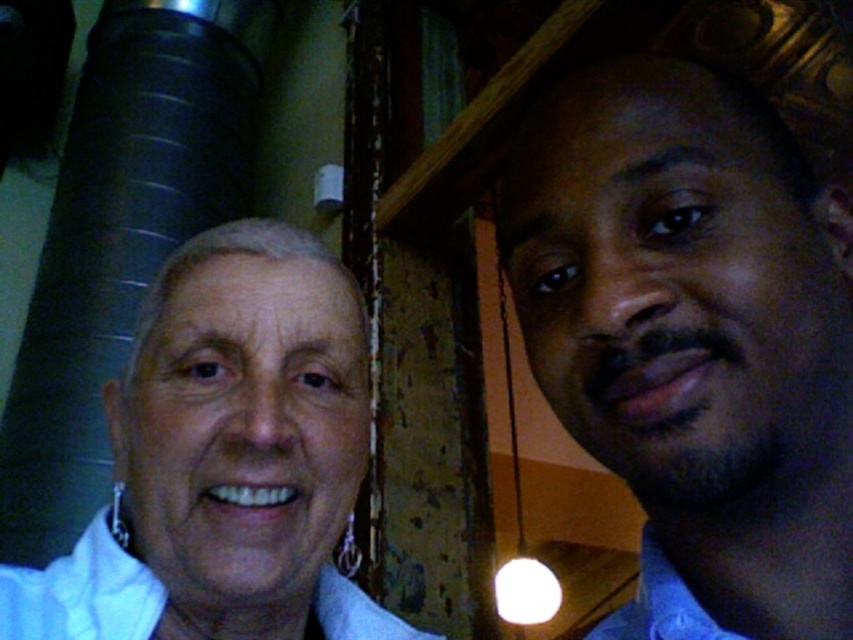
Is smooth skin face at right above white matte/soft skin at center?

Correct, smooth skin face at right is located above white matte/soft skin at center.

Measure the distance between smooth skin face at right and camera.

smooth skin face at right and camera are 12.29 inches apart.

What do you see at coordinates (693, 339) in the screenshot? The image size is (853, 640). I see `smooth skin face at right` at bounding box center [693, 339].

Identify the location of smooth skin face at right. The height and width of the screenshot is (640, 853). (693, 339).

Is point (770, 326) positioned behind point (381, 618)?

No, (770, 326) is closer to viewer.

Is smooth skin face at right shorter than white cotton dress shirt at lower left?

No.

Which is behind, point (793, 202) or point (94, 570)?

Point (94, 570)

Where is `smooth skin face at right`? The height and width of the screenshot is (640, 853). smooth skin face at right is located at coordinates (693, 339).

Is point (190, 406) closer to viewer compared to point (343, 636)?

That is True.

What do you see at coordinates (225, 458) in the screenshot? I see `white matte/soft skin at center` at bounding box center [225, 458].

Locate an element on the screen. This screenshot has height=640, width=853. white matte/soft skin at center is located at coordinates (225, 458).